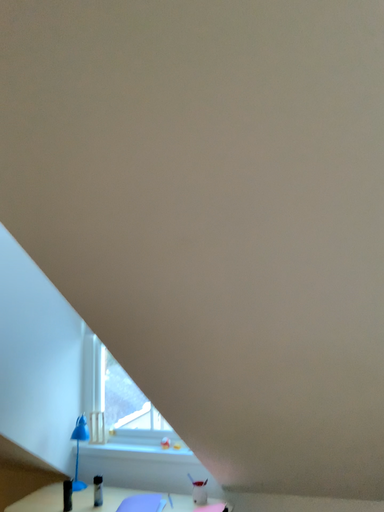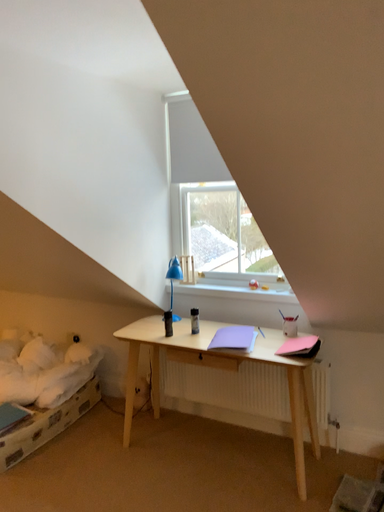
Question: Which way did the camera rotate in the video?

Choices:
 (A) rotated upward
 (B) rotated downward

Answer: (B)